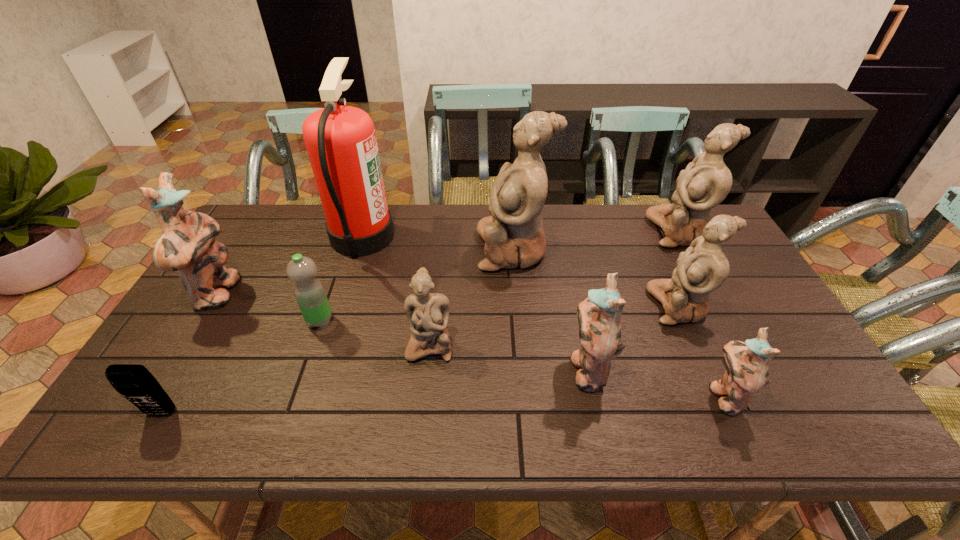
Find the location of a particular element. object that is at the far right corner is located at coordinates (706, 181).

Find the location of a particular element. blank area at the far edge is located at coordinates (592, 227).

What are the coordinates of `free space at the near edge` in the screenshot? It's located at (317, 413).

Find the location of a particular element. free space at the left edge of the desktop is located at coordinates (222, 331).

You are a GUI agent. You are given a task and a screenshot of the screen. Output one action in this format:
    pyautogui.click(x=<x>, y=<y>)
    Task: Click on the vacant space at the far left corner of the desktop
    The image size is (960, 540).
    Given the screenshot: What is the action you would take?
    pyautogui.click(x=264, y=208)

The height and width of the screenshot is (540, 960). Find the location of `unoccupied area between the water bottle and the cellular telephone`. unoccupied area between the water bottle and the cellular telephone is located at coordinates (241, 367).

Locate an element on the screen. This screenshot has width=960, height=540. free space that is in between the shortest object and the third farthest white figurine is located at coordinates [420, 360].

The height and width of the screenshot is (540, 960). In order to click on free space that is in between the ninth shortest object and the nearest white figurine in this screenshot , I will do `click(471, 297)`.

Locate an element on the screen. This screenshot has width=960, height=540. free space between the red fire extinguisher and the sixth figurine from right to left is located at coordinates 396,291.

Locate an element on the screen. The width and height of the screenshot is (960, 540). empty space that is in between the second pink figurine from left to right and the shortest object is located at coordinates (374, 391).